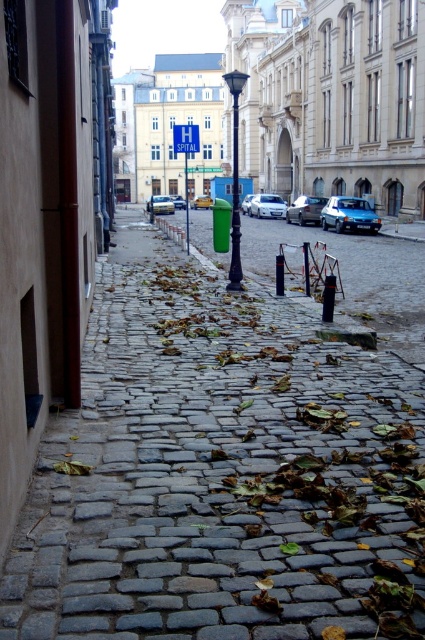
Does cobblestone pavement at center come behind yellow matte car at center?

No, it is in front of yellow matte car at center.

Does cobblestone pavement at center have a greater width compared to yellow matte car at center?

Correct, the width of cobblestone pavement at center exceeds that of yellow matte car at center.

Where is `cobblestone pavement at center`? The image size is (425, 640). cobblestone pavement at center is located at coordinates (220, 474).

From the picture: Does shiny silver sedan at center have a smaller size compared to metallic silver car at center?

Indeed, shiny silver sedan at center has a smaller size compared to metallic silver car at center.

Does shiny silver sedan at center have a greater width compared to metallic silver car at center?

Yes.

The image size is (425, 640). What are the coordinates of `shiny silver sedan at center` in the screenshot? It's located at (306, 209).

The width and height of the screenshot is (425, 640). Identify the location of shiny silver sedan at center. coord(306,209).

Between point (200, 472) and point (181, 196), which one is positioned in front?

Point (200, 472) is in front.

Is cobblestone pavement at center bigger than metallic silver car at center?

No.

Does point (255, 592) come behind point (173, 195)?

No, (255, 592) is closer to viewer.

This screenshot has width=425, height=640. Identify the location of cobblestone pavement at center. (220, 474).